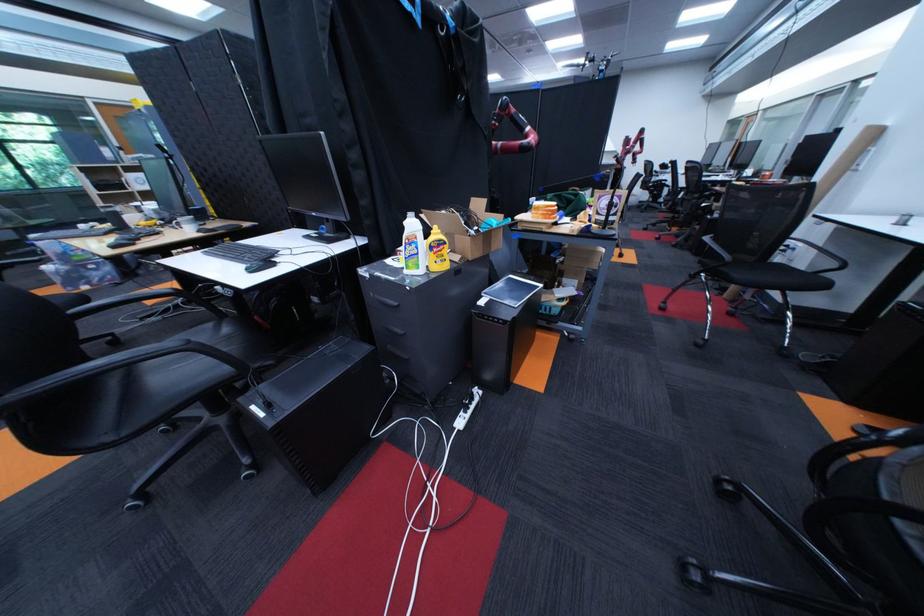
Where is `green computer mouse`? The image size is (924, 616). green computer mouse is located at coordinates (260, 265).